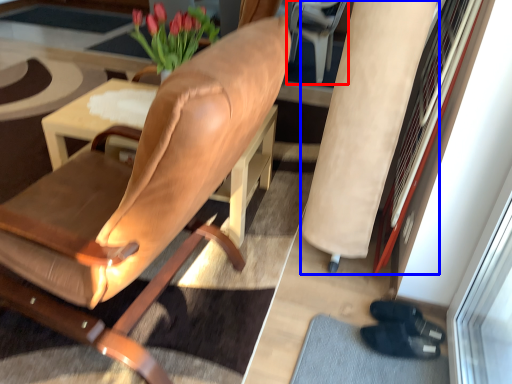
Question: Which object appears farthest to the camera in this image, armchair (highlighted by a red box) or beige (highlighted by a blue box)?

Choices:
 (A) armchair
 (B) beige

Answer: (A)